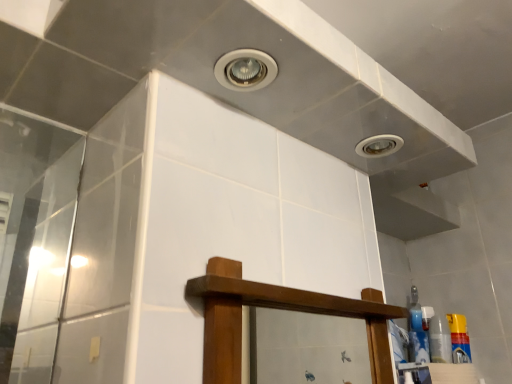
Question: Is yellow plastic spray can at right inside the boundaries of matte white droplight at upper right, or outside?

Choices:
 (A) outside
 (B) inside

Answer: (A)

Question: Is point (461, 314) positioned closer to the camera than point (373, 150)?

Choices:
 (A) farther
 (B) closer

Answer: (A)

Question: Considering the relative positions of yellow plastic spray can at right and matte white droplight at upper right in the image provided, is yellow plastic spray can at right to the left or to the right of matte white droplight at upper right?

Choices:
 (A) right
 (B) left

Answer: (A)

Question: Considering the positions of matte white droplight at upper right and yellow plastic spray can at right in the image, is matte white droplight at upper right taller or shorter than yellow plastic spray can at right?

Choices:
 (A) tall
 (B) short

Answer: (B)

Question: From the image's perspective, is matte white droplight at upper right positioned above or below yellow plastic spray can at right?

Choices:
 (A) below
 (B) above

Answer: (B)

Question: Is matte white droplight at upper right wider or thinner than yellow plastic spray can at right?

Choices:
 (A) wide
 (B) thin

Answer: (A)

Question: Is matte white droplight at upper right spatially inside yellow plastic spray can at right, or outside of it?

Choices:
 (A) inside
 (B) outside

Answer: (B)